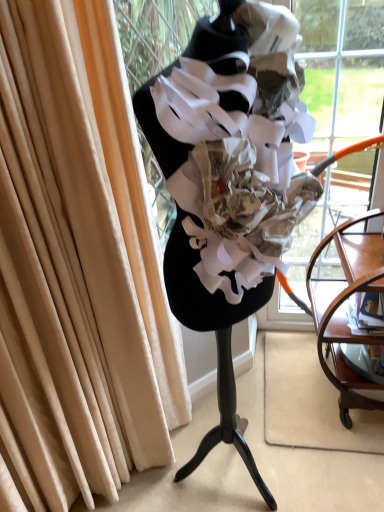
Describe the element at coordinates (358, 361) in the screenshot. The image size is (384, 512). I see `clear glass shelf at lower right` at that location.

In order to face mahogany wood side table at right, should I rotate leftwards or rightwards?

Turn right by 21.315 degrees to look at mahogany wood side table at right.

Measure the distance between transparent glass shop window at center and camera.

transparent glass shop window at center and camera are 29.99 inches apart.

At what (x,y) coordinates should I click in order to perform the action: click on beige velvet curtain at left. Please return your answer as a coordinate pair (x, y). Looking at the image, I should click on (78, 265).

Which is more to the right, beige velvet curtain at left or clear glass shelf at lower right?

From the viewer's perspective, clear glass shelf at lower right appears more on the right side.

From a real-world perspective, is beige velvet curtain at left physically below clear glass shelf at lower right?

No.

Which is behind, point (129, 147) or point (352, 365)?

The point (352, 365) is farther from the camera.

Is beige velvet curtain at left oriented away from clear glass shelf at lower right?

beige velvet curtain at left does not have its back to clear glass shelf at lower right.

Is clear glass shelf at lower right oriented towards mahogany wood side table at right?

Yes, clear glass shelf at lower right faces towards mahogany wood side table at right.

Would you consider clear glass shelf at lower right to be distant from mahogany wood side table at right?

Actually, clear glass shelf at lower right and mahogany wood side table at right are a little close together.

Does clear glass shelf at lower right have a smaller size compared to mahogany wood side table at right?

Yes, clear glass shelf at lower right is smaller than mahogany wood side table at right.

Consider the image. From a real-world perspective, which object stands above the other?

mahogany wood side table at right.

Is clear glass shelf at lower right with beige velvet curtain at left?

They are not placed beside each other.

From the image's perspective, does clear glass shelf at lower right appear higher than beige velvet curtain at left?

Incorrect, from the image's perspective, clear glass shelf at lower right is lower than beige velvet curtain at left.

Is clear glass shelf at lower right bigger or smaller than beige velvet curtain at left?

In the image, clear glass shelf at lower right appears to be smaller than beige velvet curtain at left.

The image size is (384, 512). What are the coordinates of `curtain above the clear glass shelf at lower right (from a real-world perspective)` in the screenshot? It's located at (78, 265).

From the image's perspective, is mahogany wood side table at right above or below transparent glass shop window at center?

Clearly, from the image's perspective, mahogany wood side table at right is below transparent glass shop window at center.

Between mahogany wood side table at right and transparent glass shop window at center, which one is positioned behind?

mahogany wood side table at right is behind.

From a real-world perspective, is mahogany wood side table at right physically above transparent glass shop window at center?

Incorrect, from a real-world perspective, mahogany wood side table at right is lower than transparent glass shop window at center.

Does mahogany wood side table at right have a greater width compared to transparent glass shop window at center?

Correct, the width of mahogany wood side table at right exceeds that of transparent glass shop window at center.

Is transparent glass shop window at center not close to mahogany wood side table at right?

No, transparent glass shop window at center is not far from mahogany wood side table at right.

Measure the distance from transparent glass shop window at center to mahogany wood side table at right.

A distance of 64.10 centimeters exists between transparent glass shop window at center and mahogany wood side table at right.

Which object is thinner, transparent glass shop window at center or mahogany wood side table at right?

Thinner between the two is transparent glass shop window at center.

Which is farther from the camera, (195, 32) or (319, 359)?

The point (319, 359) is behind.

This screenshot has width=384, height=512. Find the location of `shelf below the mahogany wood side table at right (from a real-world perspective)`. shelf below the mahogany wood side table at right (from a real-world perspective) is located at coordinates click(358, 361).

Would you say clear glass shelf at lower right is part of mahogany wood side table at right's contents?

Indeed, clear glass shelf at lower right is located within mahogany wood side table at right.

How far apart are mahogany wood side table at right and clear glass shelf at lower right?

The distance of mahogany wood side table at right from clear glass shelf at lower right is 9.17 inches.

Considering the relative positions of mahogany wood side table at right and clear glass shelf at lower right in the image provided, is mahogany wood side table at right to the left or to the right of clear glass shelf at lower right?

From the image, it's evident that mahogany wood side table at right is to the left of clear glass shelf at lower right.

Between beige velvet curtain at left and mahogany wood side table at right, which one appears on the right side from the viewer's perspective?

From the viewer's perspective, mahogany wood side table at right appears more on the right side.

Is beige velvet curtain at left directly adjacent to mahogany wood side table at right?

No, beige velvet curtain at left is not with mahogany wood side table at right.

Is beige velvet curtain at left inside the boundaries of mahogany wood side table at right, or outside?

beige velvet curtain at left is located beyond the bounds of mahogany wood side table at right.

From a real-world perspective, which object stands above the other?

beige velvet curtain at left is physically above.

Locate an element on the screen. shelf to the right of beige velvet curtain at left is located at coordinates (358, 361).

Locate an element on the screen. The height and width of the screenshot is (512, 384). shelf that is under the mahogany wood side table at right (from a real-world perspective) is located at coordinates (358, 361).

Which object lies further to the anchor point transparent glass shop window at center, clear glass shelf at lower right or beige velvet curtain at left?

clear glass shelf at lower right is positioned further to the anchor transparent glass shop window at center.

When comparing their distances from clear glass shelf at lower right, does beige velvet curtain at left or transparent glass shop window at center seem further?

Among the two, beige velvet curtain at left is located further to clear glass shelf at lower right.

Looking at the image, which one is located closer to transparent glass shop window at center, clear glass shelf at lower right or mahogany wood side table at right?

mahogany wood side table at right.

Estimate the real-world distances between objects in this image. Which object is closer to beige velvet curtain at left, mahogany wood side table at right or transparent glass shop window at center?

transparent glass shop window at center is closer to beige velvet curtain at left.

Which object lies further to the anchor point clear glass shelf at lower right, transparent glass shop window at center or mahogany wood side table at right?

transparent glass shop window at center.

Which object lies nearer to the anchor point mahogany wood side table at right, transparent glass shop window at center or beige velvet curtain at left?

The object closer to mahogany wood side table at right is transparent glass shop window at center.

Which object lies further to the anchor point beige velvet curtain at left, mahogany wood side table at right or clear glass shelf at lower right?

clear glass shelf at lower right is positioned further to the anchor beige velvet curtain at left.

When comparing their distances from transparent glass shop window at center, does mahogany wood side table at right or clear glass shelf at lower right seem further?

clear glass shelf at lower right.

Identify the location of furniture between transparent glass shop window at center and clear glass shelf at lower right along the z-axis. Image resolution: width=384 pixels, height=512 pixels. (346, 310).

Locate an element on the screen. furniture between beige velvet curtain at left and clear glass shelf at lower right from left to right is located at coordinates (346, 310).

Identify the location of shop window between beige velvet curtain at left and mahogany wood side table at right from left to right. The height and width of the screenshot is (512, 384). (220, 162).

Find the location of a particular element. This screenshot has height=512, width=384. curtain positioned between transparent glass shop window at center and clear glass shelf at lower right from near to far is located at coordinates (78, 265).